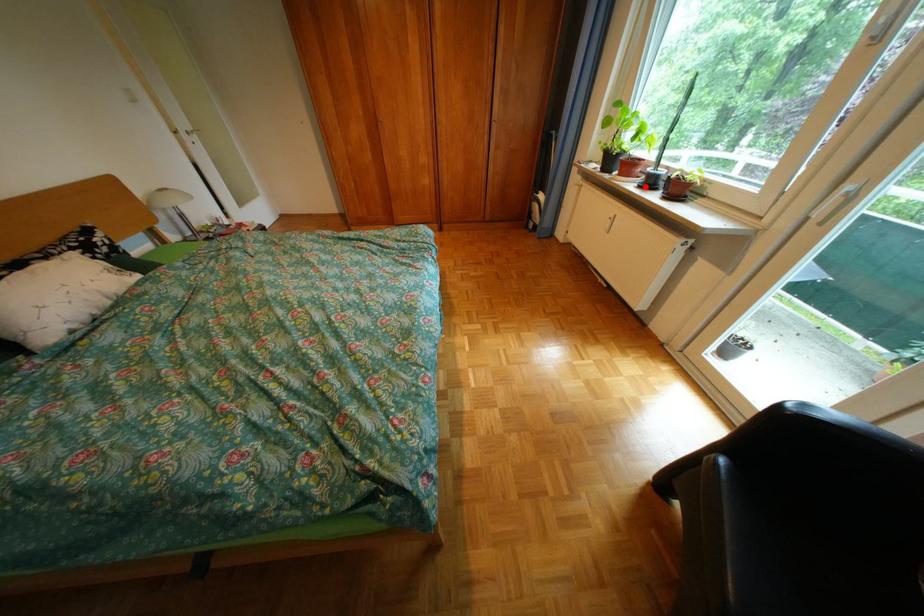
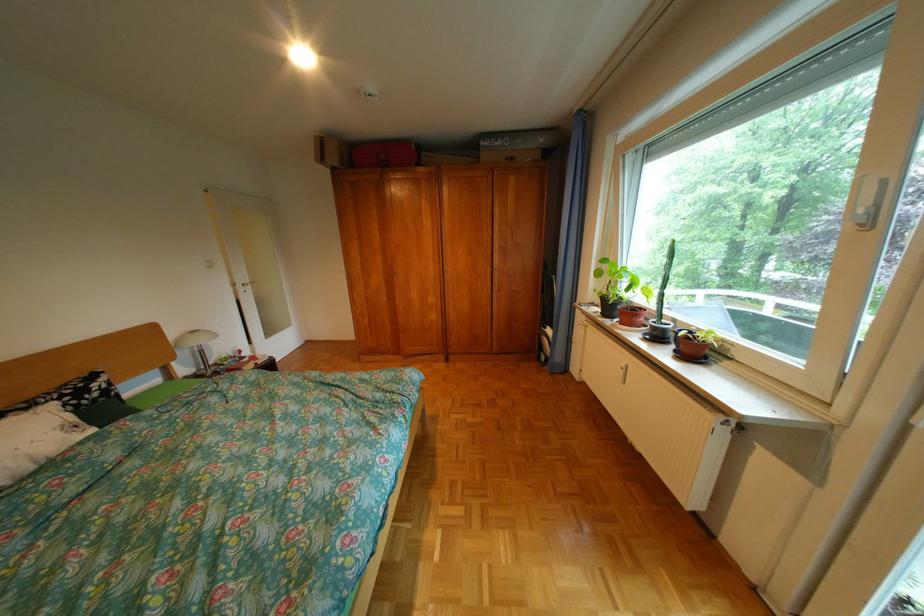
Question: I am providing you with two images of the same scene from different viewpoints. A red point is marked on the first image. At the location where the point appears in image 1, is it still visible in image 2?

Choices:
 (A) Yes
 (B) No

Answer: (A)